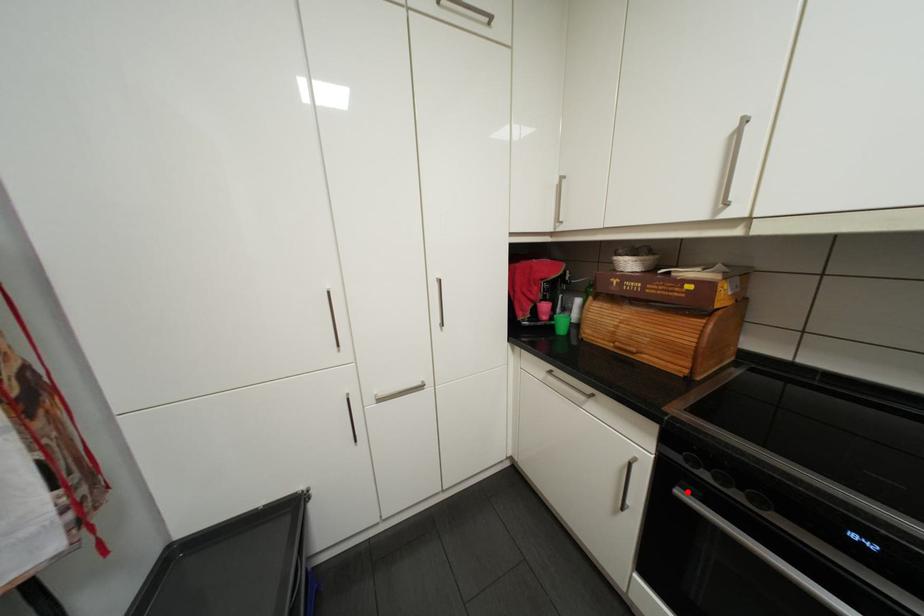
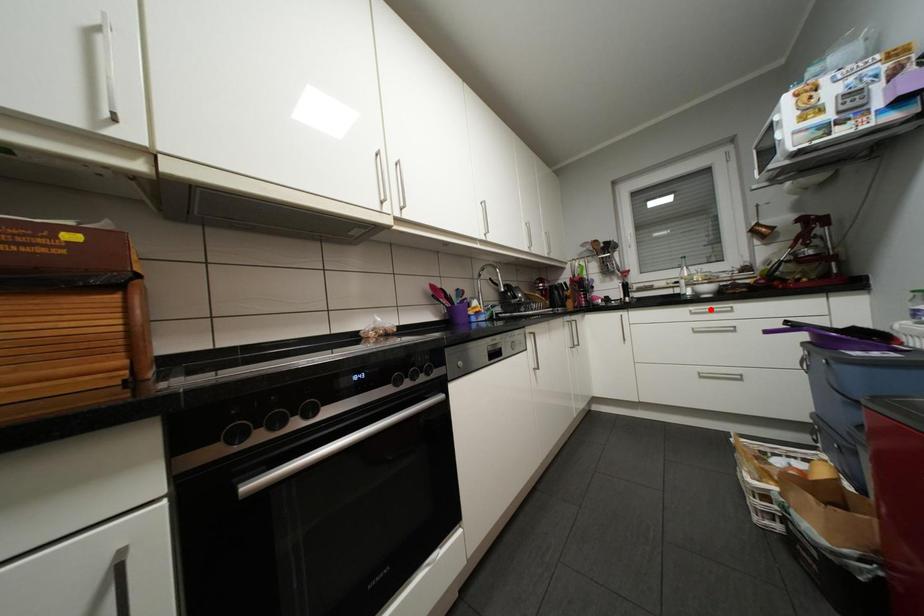
I am providing you with two images of the same scene from different viewpoints. A red point is marked on the first image and another point is marked on the second image. Is the marked point in image1 the same physical position as the marked point in image2?

No